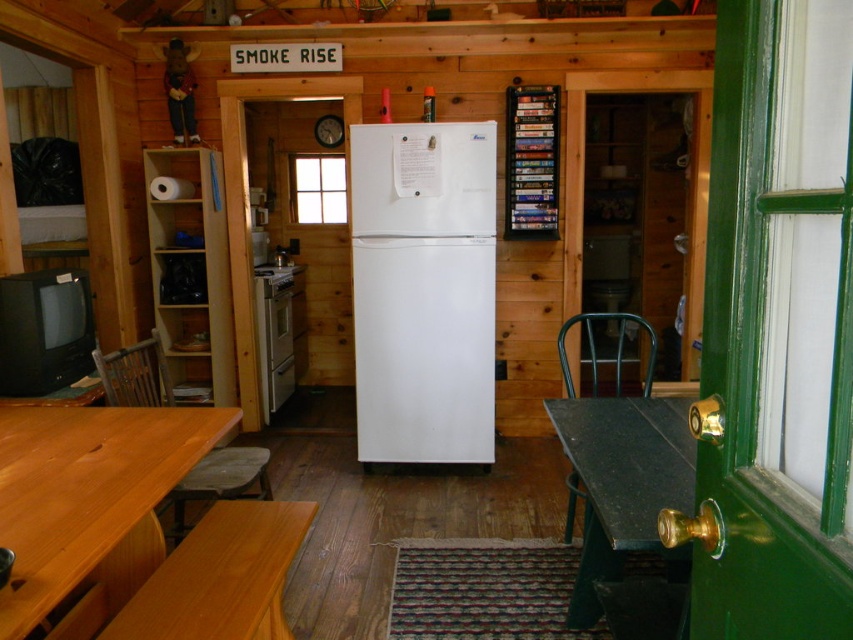
Can you confirm if white matte refrigerator at center is positioned above wooden chair at lower left?

Indeed, white matte refrigerator at center is positioned over wooden chair at lower left.

Between white matte refrigerator at center and wooden chair at lower left, which one is positioned lower?

wooden chair at lower left is lower down.

Does point (372, 156) come closer to viewer compared to point (160, 372)?

No.

This screenshot has height=640, width=853. I want to click on white matte refrigerator at center, so click(422, 291).

Who is taller, green marble table at right or light brown wood table at lower left?

green marble table at right is taller.

Can you confirm if green marble table at right is taller than light brown wood table at lower left?

Yes.

Locate an element on the screen. The width and height of the screenshot is (853, 640). green marble table at right is located at coordinates (624, 483).

I want to click on green marble table at right, so click(x=624, y=483).

Between natural wood table at lower left and light brown wood table at lower left, which one has less height?

natural wood table at lower left

At what (x,y) coordinates should I click in order to perform the action: click on natural wood table at lower left. Please return your answer as a coordinate pair (x, y). Looking at the image, I should click on (84, 490).

Where is `natural wood table at lower left`? Image resolution: width=853 pixels, height=640 pixels. natural wood table at lower left is located at coordinates (x=84, y=490).